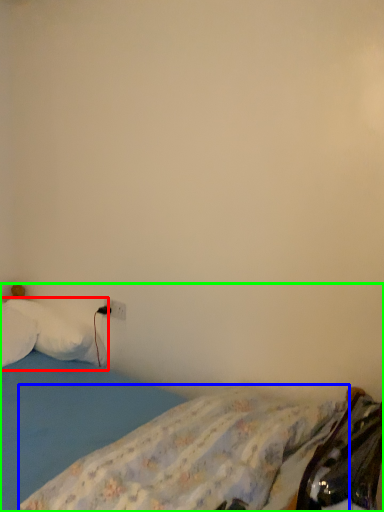
Question: Based on their relative distances, which object is nearer to pillow (highlighted by a red box)? Choose from mattress (highlighted by a blue box) and bed (highlighted by a green box).

Choices:
 (A) mattress
 (B) bed

Answer: (B)